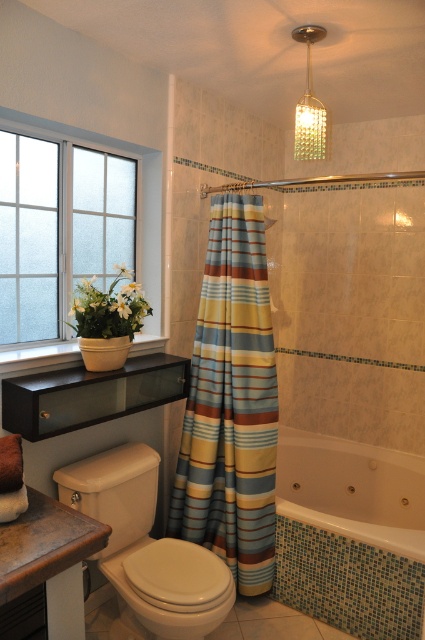
Describe the element at coordinates (102, 209) in the screenshot. I see `frosted glass window at left` at that location.

Based on the photo, is frosted glass window at left further to camera compared to white glossy toilet bowl at lower left?

Yes, frosted glass window at left is behind white glossy toilet bowl at lower left.

You are a GUI agent. You are given a task and a screenshot of the screen. Output one action in this format:
    pyautogui.click(x=<x>, y=<y>)
    Task: Click on the frosted glass window at left
    
    Given the screenshot: What is the action you would take?
    pyautogui.click(x=102, y=209)

Does point (155, 492) come in front of point (78, 636)?

No, it is not.

Is point (197, 557) closer to viewer compared to point (87, 548)?

No, (197, 557) is behind (87, 548).

The image size is (425, 640). Find the location of `beige ceramic toilet at lower left`. beige ceramic toilet at lower left is located at coordinates (147, 545).

Is point (251, 218) positioned before point (314, 132)?

No.

This screenshot has width=425, height=640. I want to click on striped fabric shower curtain at center, so click(x=231, y=403).